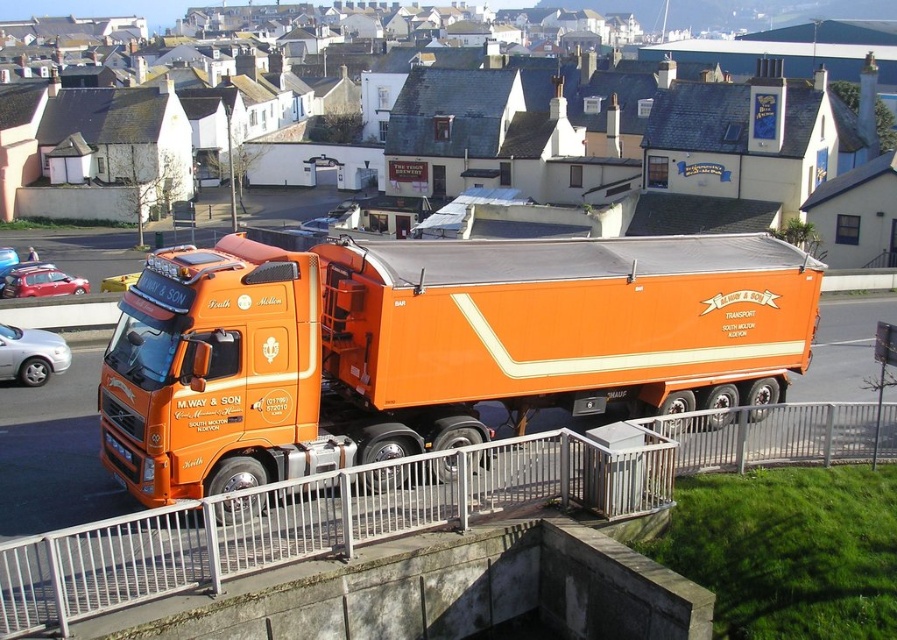
Does silver metallic sedan at lower left have a lesser height compared to shiny red car at left?

In fact, silver metallic sedan at lower left may be taller than shiny red car at left.

Is point (29, 368) in front of point (65, 275)?

Yes.

At what (x,y) coordinates should I click in order to perform the action: click on silver metallic sedan at lower left. Please return your answer as a coordinate pair (x, y). The height and width of the screenshot is (640, 897). Looking at the image, I should click on (31, 355).

Can you confirm if white metal railing at center is positioned below silver metallic sedan at lower left?

Correct, white metal railing at center is located below silver metallic sedan at lower left.

Image resolution: width=897 pixels, height=640 pixels. Describe the element at coordinates (408, 504) in the screenshot. I see `white metal railing at center` at that location.

The width and height of the screenshot is (897, 640). Identify the location of white metal railing at center. (408, 504).

Who is positioned more to the right, orange matte truck at center or white metal railing at center?

From the viewer's perspective, white metal railing at center appears more on the right side.

Is orange matte truck at center behind white metal railing at center?

That is True.

Who is more forward, (601, 316) or (96, 536)?

Point (96, 536) is in front.

You are a GUI agent. You are given a task and a screenshot of the screen. Output one action in this format:
    pyautogui.click(x=<x>, y=<y>)
    Task: Click on the orange matte truck at center
    The image size is (897, 640).
    Given the screenshot: What is the action you would take?
    pyautogui.click(x=430, y=346)